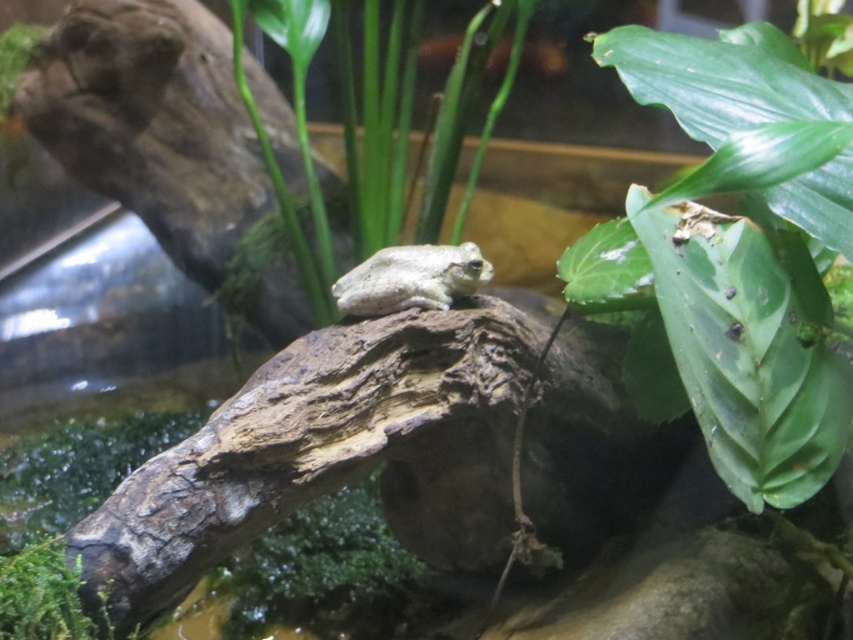
Question: Does green matte leaf at upper right have a larger size compared to green mossy rock at lower left?

Choices:
 (A) yes
 (B) no

Answer: (A)

Question: Which object appears farthest from the camera in this image?

Choices:
 (A) gray matte frog at center
 (B) green matte leaf at upper right
 (C) green leafy plant at center

Answer: (C)

Question: Which object is the farthest from the green leafy plant at center?

Choices:
 (A) gray matte frog at center
 (B) green mossy rock at lower left
 (C) green matte leaf at upper right

Answer: (B)

Question: Is green matte leaf at upper right bigger than green leafy plant at center?

Choices:
 (A) yes
 (B) no

Answer: (B)

Question: Which object is farther from the camera taking this photo?

Choices:
 (A) gray matte frog at center
 (B) green leafy plant at center
 (C) green matte leaf at upper right
 (D) green mossy rock at lower left

Answer: (B)

Question: Does green leafy plant at center have a lesser width compared to green mossy rock at lower left?

Choices:
 (A) no
 (B) yes

Answer: (A)